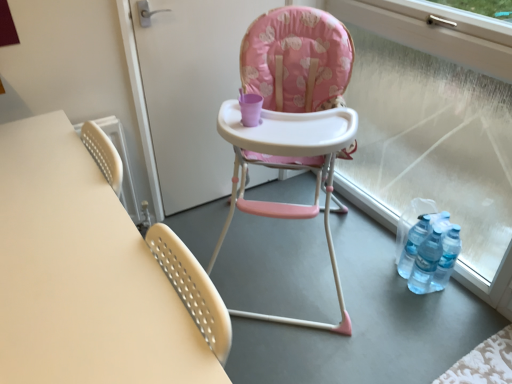
The image size is (512, 384). In order to click on free spot below pink fabric highchair at center (from a real-world perspective) in this screenshot , I will do `click(283, 258)`.